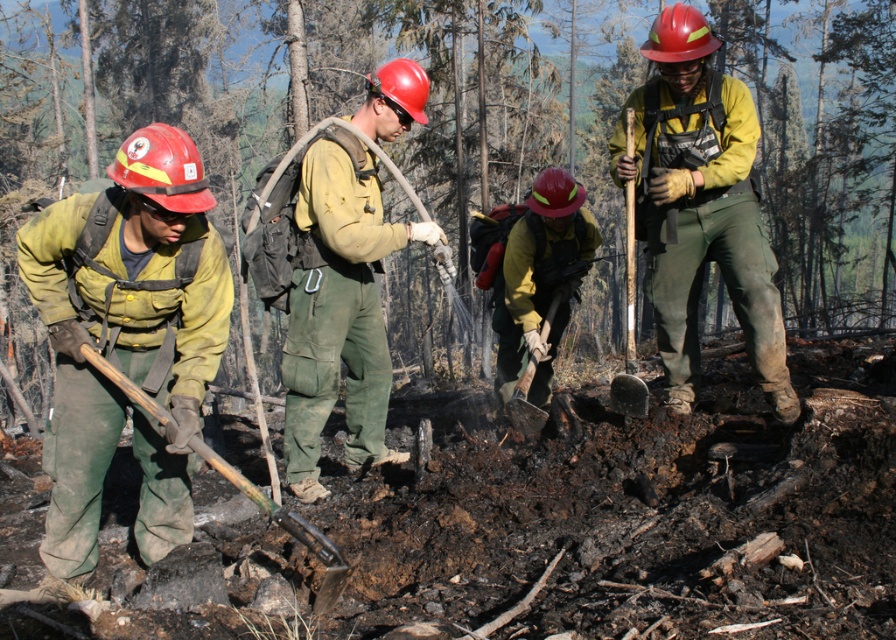
You are a firefighter in the scene and need to check the equipment of the person closest to you. Which piece of clothing is closer to you, the green canvas pants at center or the matte yellow jacket at center?

The green canvas pants at center is in front of matte yellow jacket at center, so the green canvas pants at center is closer to you.